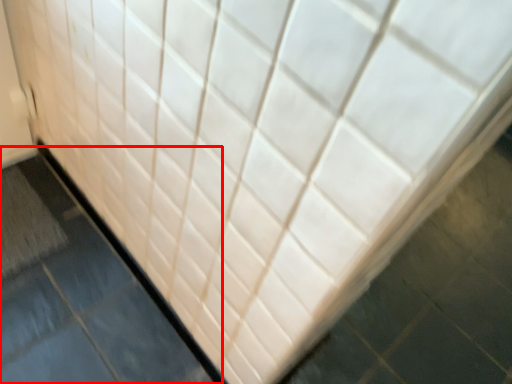
Question: From the image's perspective, what is the correct spatial relationship of slate (annotated by the red box) in relation to bath mat?

Choices:
 (A) above
 (B) below

Answer: (B)